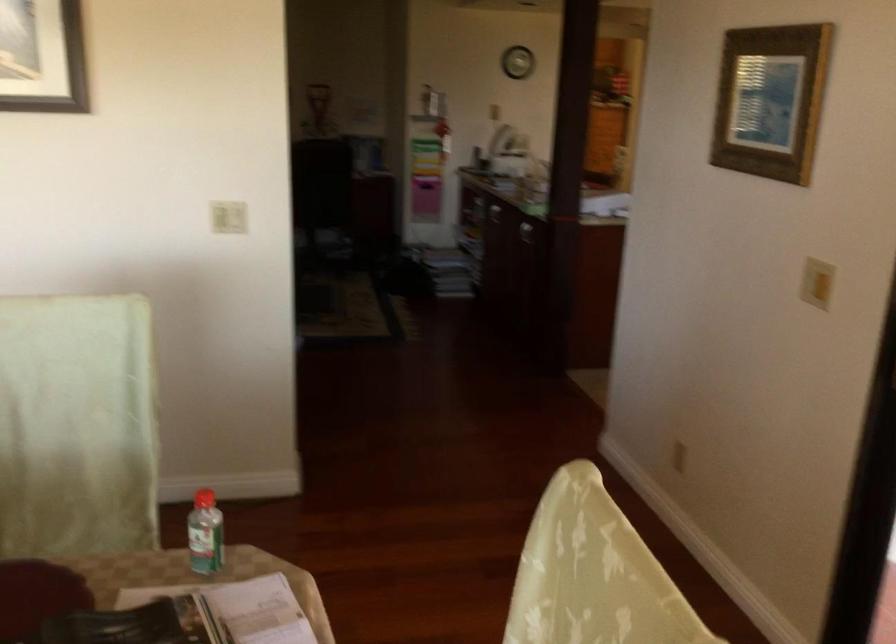
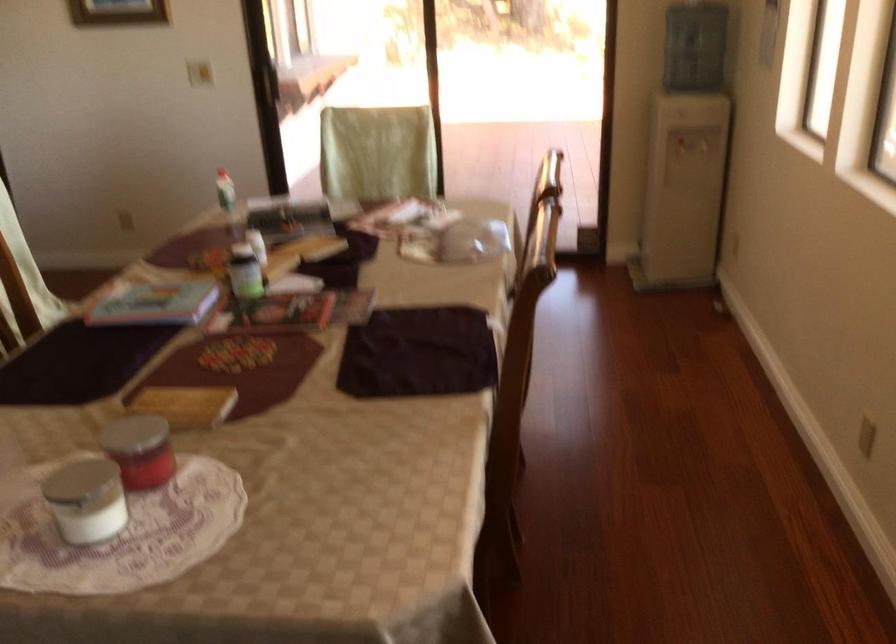
Question: I am providing you with two images of the same scene from different viewpoints. Which of the following objects are not visible in image2?

Choices:
 (A) white jar lid
 (B) red bottle cap
 (C) white ladle
 (D) red dispenser tap

Answer: (B)